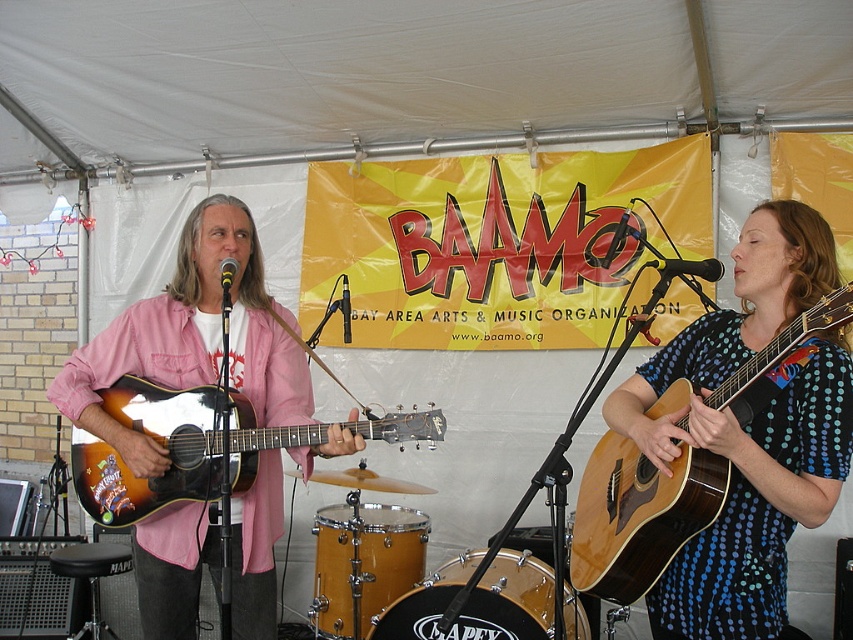
You are a photographer at the music event. You want to take a photo that includes both the natural wood acoustic guitar at right and the yellow wood drum at lower center. Which one should you position closer to the left side of the frame?

You should position the yellow wood drum at lower center closer to the left side of the frame because the natural wood acoustic guitar at right is to the right of it.

Consider the image. You are a photographer taking pictures of the sunburst wood acoustic guitar at left and the yellow wood drum at lower center. Which instrument will appear larger in your photos?

The sunburst wood acoustic guitar at left will appear larger in the photos because it is closer to the viewer than the yellow wood drum at lower center.